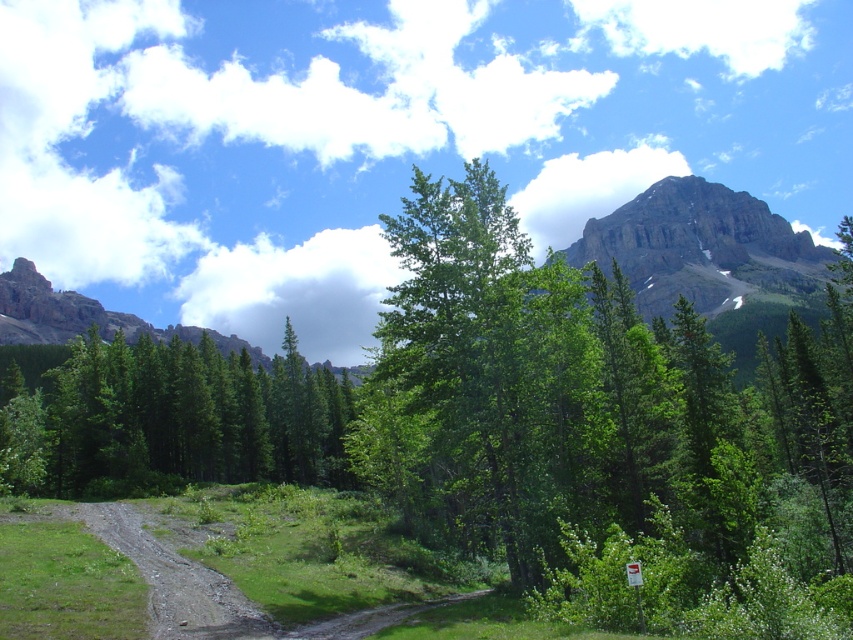
Between green matte tree at center and rugged stone mountain at upper left, which one has less height?

green matte tree at center

At what (x,y) coordinates should I click in order to perform the action: click on green matte tree at center. Please return your answer as a coordinate pair (x, y). The width and height of the screenshot is (853, 640). Looking at the image, I should click on (178, 417).

Is point (38, 417) closer to camera compared to point (776, 230)?

Yes, it is in front of point (776, 230).

Does green matte tree at center have a greater width compared to rocky gray mountain at upper right?

No, green matte tree at center is not wider than rocky gray mountain at upper right.

Where is `green matte tree at center`? The height and width of the screenshot is (640, 853). green matte tree at center is located at coordinates click(x=178, y=417).

This screenshot has height=640, width=853. What do you see at coordinates (590, 412) in the screenshot?
I see `green leafy tree at center` at bounding box center [590, 412].

Is green leafy tree at center below rugged stone mountain at upper left?

Indeed, green leafy tree at center is positioned under rugged stone mountain at upper left.

The image size is (853, 640). Describe the element at coordinates (590, 412) in the screenshot. I see `green leafy tree at center` at that location.

Find the location of a particular element. This screenshot has width=853, height=640. green leafy tree at center is located at coordinates (590, 412).